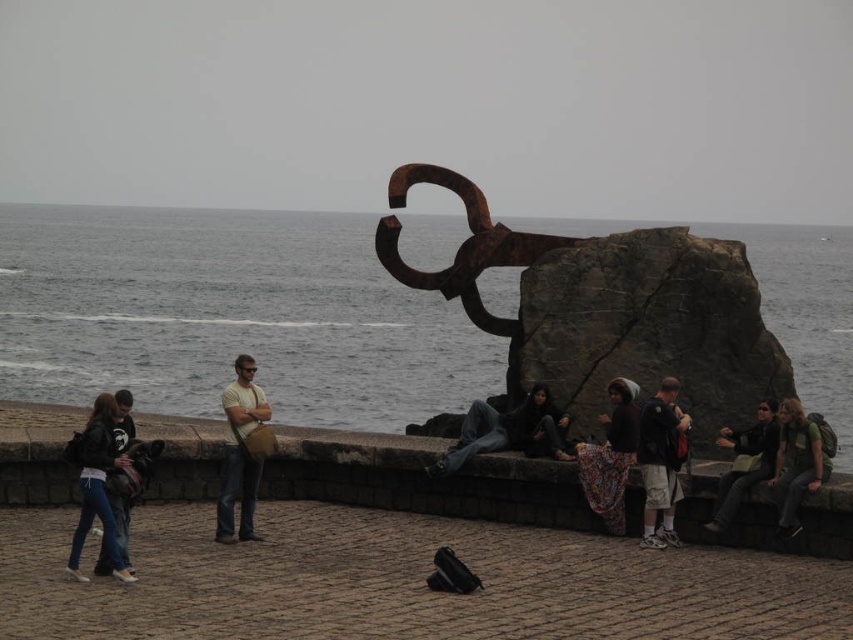
You are a photographer trying to capture a photo of the coastal sculpture. You notice two people in the foreground wearing a matte black jacket at lower left and dark gray shorts at center. Since you want to focus on the sculpture, which clothing item should you avoid including in your shot to minimize distraction? Explain your reasoning.

You should avoid including the matte black jacket at lower left in your shot because it is larger in size than the dark gray shorts at center, making it more likely to draw attention away from the sculpture.

You are a photographer trying to capture the sculpture in the background. You notice two people wearing a matte black jacket at lower left and dark gray shorts at center. Which clothing item is positioned higher relative to the other?

The matte black jacket at lower left is taller than the dark gray shorts at center, so the matte black jacket at lower left is positioned higher.

You are a photographer positioned at the edge of the paved area. You want to capture both the dark gray shorts at center and the dark gray fabric jacket at lower right in the same frame. Which subject should you focus on first to ensure both are in focus?

You should focus on the dark gray shorts at center first because it is closer to you than the dark gray fabric jacket at lower right, so focusing on the closer subject will help both be in focus.